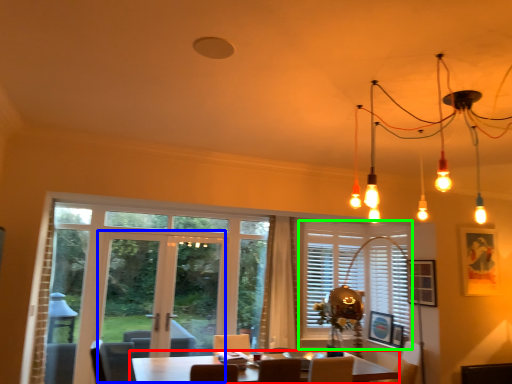
Question: Which object is positioned closest to table (highlighted by a red box)? Select from screen door (highlighted by a blue box) and window (highlighted by a green box).

Choices:
 (A) screen door
 (B) window

Answer: (A)